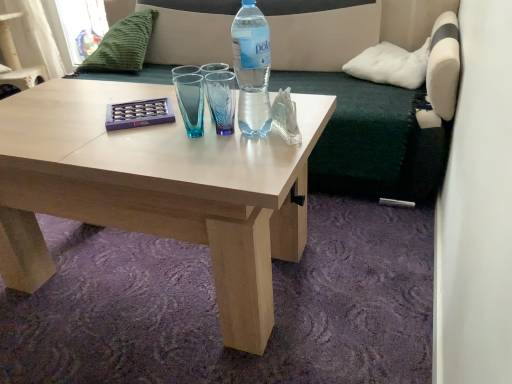
Question: From the image's perspective, is green knitted pillow at upper left, acting as the second pillow starting from the right, located above translucent plastic bottle at center?

Choices:
 (A) yes
 (B) no

Answer: (A)

Question: Is green knitted pillow at upper left, which appears as the 1th pillow when viewed from the left, bigger than translucent plastic bottle at center?

Choices:
 (A) no
 (B) yes

Answer: (B)

Question: Can you confirm if green knitted pillow at upper left, which appears as the 1th pillow when viewed from the back, is thinner than translucent plastic bottle at center?

Choices:
 (A) yes
 (B) no

Answer: (B)

Question: From the image's perspective, is green knitted pillow at upper left, which appears as the 1th pillow when viewed from the back, under translucent plastic bottle at center?

Choices:
 (A) no
 (B) yes

Answer: (A)

Question: Is green knitted pillow at upper left, arranged as the 2th pillow when viewed from the front, positioned with its back to translucent plastic bottle at center?

Choices:
 (A) no
 (B) yes

Answer: (A)

Question: Is point (22, 77) closer or farther from the camera than point (246, 74)?

Choices:
 (A) farther
 (B) closer

Answer: (A)

Question: Considering the positions of white fabric armchair at upper left and translucent plastic bottle at center in the image, is white fabric armchair at upper left wider or thinner than translucent plastic bottle at center?

Choices:
 (A) wide
 (B) thin

Answer: (A)

Question: From a real-world perspective, relative to translucent plastic bottle at center, is white fabric armchair at upper left vertically above or below?

Choices:
 (A) below
 (B) above

Answer: (A)

Question: In the image, is white fabric armchair at upper left positioned in front of or behind translucent plastic bottle at center?

Choices:
 (A) behind
 (B) front

Answer: (A)

Question: Is white soft pillow at upper right, arranged as the first pillow when viewed from the right, in front of or behind dark green fabric couch at upper center in the image?

Choices:
 (A) front
 (B) behind

Answer: (B)

Question: In terms of width, does white soft pillow at upper right, arranged as the first pillow when viewed from the front, look wider or thinner when compared to dark green fabric couch at upper center?

Choices:
 (A) thin
 (B) wide

Answer: (A)

Question: Do you think white soft pillow at upper right, arranged as the first pillow when viewed from the front, is within dark green fabric couch at upper center, or outside of it?

Choices:
 (A) outside
 (B) inside

Answer: (B)

Question: From the image's perspective, is white soft pillow at upper right, arranged as the first pillow when viewed from the right, above or below dark green fabric couch at upper center?

Choices:
 (A) below
 (B) above

Answer: (A)

Question: Does point (450, 104) appear closer or farther from the camera than point (386, 46)?

Choices:
 (A) farther
 (B) closer

Answer: (B)

Question: Is dark green fabric couch at upper center in front of or behind white soft pillow at upper right, acting as the second pillow starting from the left, in the image?

Choices:
 (A) front
 (B) behind

Answer: (A)